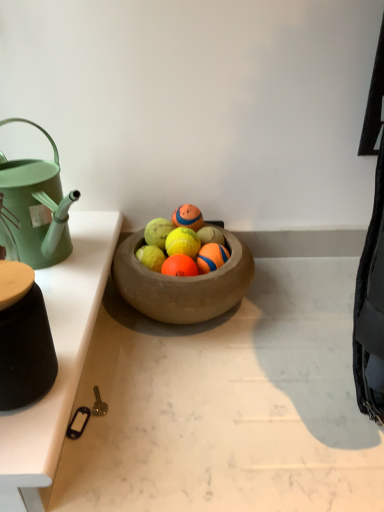
Question: Which direction should I rotate to look at orange rubber ball at center, the 3th fruit from the right?

Choices:
 (A) left
 (B) right

Answer: (A)

Question: Is orange rubber ball at center, the 3th fruit from the right, next to yellow rubber tennis ball at center, positioned as the 2th fruit in left-to-right order?

Choices:
 (A) no
 (B) yes

Answer: (B)

Question: Does orange rubber ball at center, which is counted as the first fruit, starting from the left, come in front of yellow rubber tennis ball at center, positioned as the 2th fruit in left-to-right order?

Choices:
 (A) yes
 (B) no

Answer: (A)

Question: From the image's perspective, is orange rubber ball at center, which is counted as the first fruit, starting from the left, located above yellow rubber tennis ball at center, positioned as the 2th fruit in left-to-right order?

Choices:
 (A) yes
 (B) no

Answer: (B)

Question: Can you confirm if orange rubber ball at center, which is counted as the first fruit, starting from the left, is thinner than yellow rubber tennis ball at center, the 2th fruit when ordered from right to left?

Choices:
 (A) yes
 (B) no

Answer: (B)

Question: From a real-world perspective, is orange rubber ball at center, the 3th fruit from the right, physically below yellow rubber tennis ball at center, the 2th fruit when ordered from right to left?

Choices:
 (A) no
 (B) yes

Answer: (B)

Question: Considering the relative sizes of orange rubber ball at center, which is counted as the first fruit, starting from the left, and yellow rubber tennis ball at center, the 2th fruit when ordered from right to left, in the image provided, is orange rubber ball at center, which is counted as the first fruit, starting from the left, smaller than yellow rubber tennis ball at center, the 2th fruit when ordered from right to left,?

Choices:
 (A) no
 (B) yes

Answer: (A)

Question: From a real-world perspective, is yellow rubber tennis ball at center, positioned as the 2th fruit in left-to-right order, positioned over orange rubber ball at center, the 3th fruit from the right, based on gravity?

Choices:
 (A) no
 (B) yes

Answer: (B)

Question: Is yellow rubber tennis ball at center, positioned as the 2th fruit in left-to-right order, facing away from orange rubber ball at center, the 3th fruit from the right?

Choices:
 (A) no
 (B) yes

Answer: (A)

Question: Considering the relative sizes of yellow rubber tennis ball at center, positioned as the 2th fruit in left-to-right order, and orange rubber ball at center, the 3th fruit from the right, in the image provided, is yellow rubber tennis ball at center, positioned as the 2th fruit in left-to-right order, wider than orange rubber ball at center, the 3th fruit from the right,?

Choices:
 (A) no
 (B) yes

Answer: (A)

Question: Can you confirm if yellow rubber tennis ball at center, the 2th fruit when ordered from right to left, is bigger than orange rubber ball at center, which is counted as the first fruit, starting from the left?

Choices:
 (A) no
 (B) yes

Answer: (A)

Question: Considering the relative positions of yellow rubber tennis ball at center, the 2th fruit when ordered from right to left, and orange rubber ball at center, which is counted as the first fruit, starting from the left, in the image provided, is yellow rubber tennis ball at center, the 2th fruit when ordered from right to left, in front of orange rubber ball at center, which is counted as the first fruit, starting from the left,?

Choices:
 (A) no
 (B) yes

Answer: (A)

Question: Considering the relative sizes of yellow rubber tennis ball at center, the 2th fruit when ordered from right to left, and orange rubber ball at center, the 3th fruit from the right, in the image provided, is yellow rubber tennis ball at center, the 2th fruit when ordered from right to left, smaller than orange rubber ball at center, the 3th fruit from the right,?

Choices:
 (A) yes
 (B) no

Answer: (A)

Question: Is white glossy table at left to the left of orange rubber ball at center, positioned as the third fruit in left-to-right order, from the viewer's perspective?

Choices:
 (A) yes
 (B) no

Answer: (A)